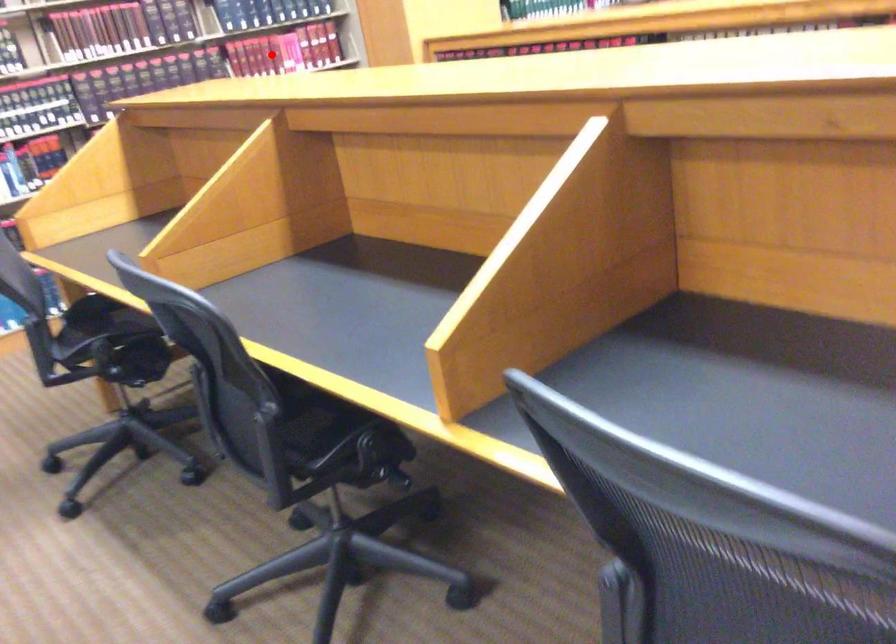
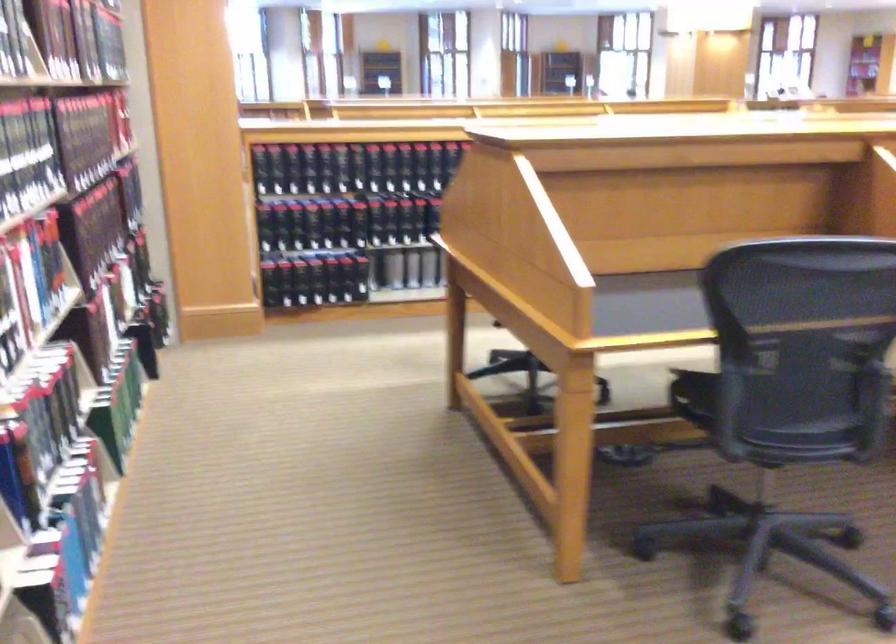
Question: I am providing you with two images of the same scene from different viewpoints. A red point is marked on the first image. Is the red point's position out of view in image 2?

Choices:
 (A) Yes
 (B) No

Answer: (A)